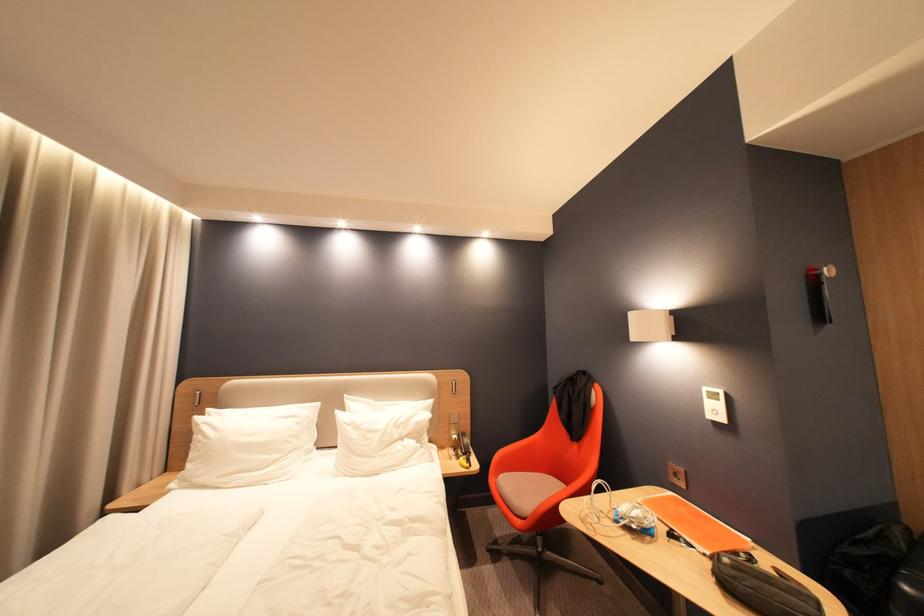
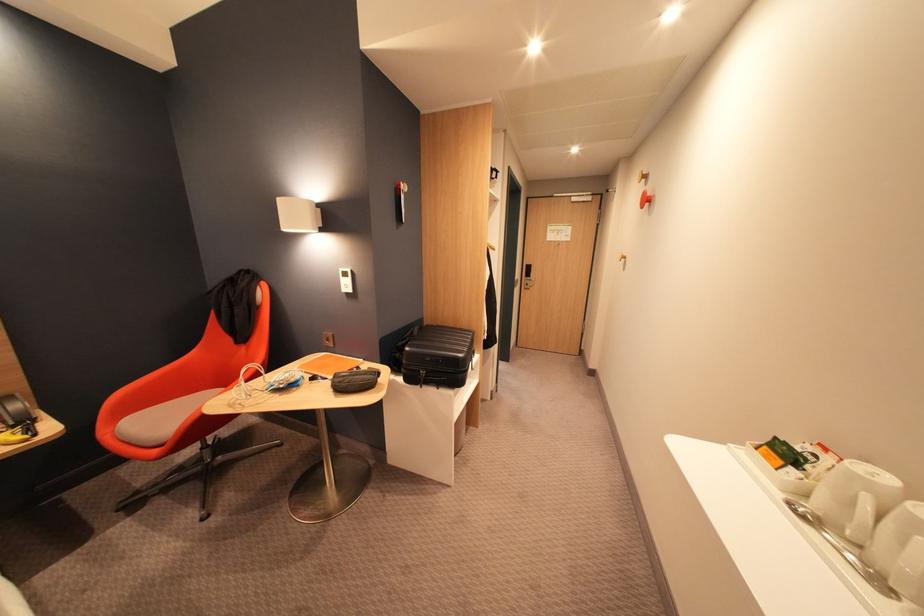
The images are taken continuously from a first-person perspective. In which direction is your viewpoint rotating?

The camera's rotation is toward right-down.